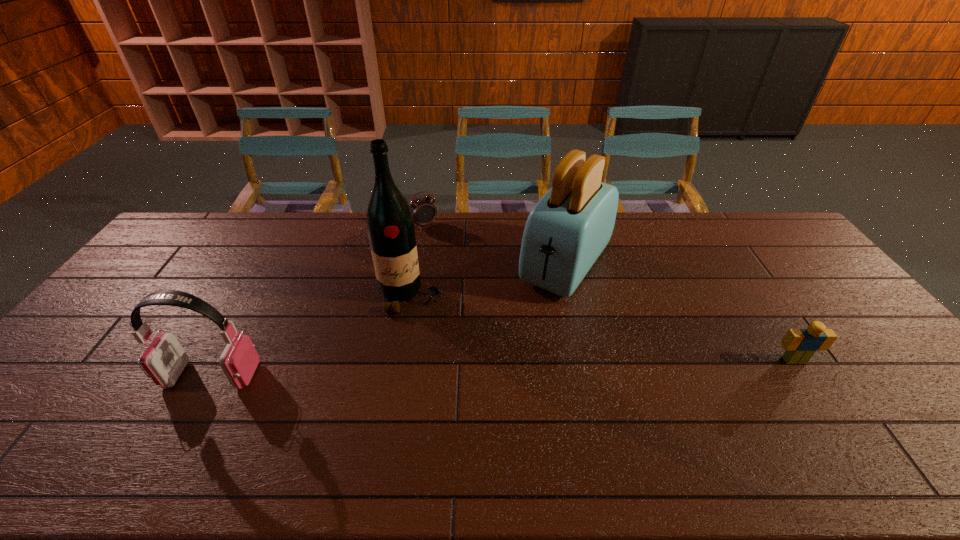
The height and width of the screenshot is (540, 960). I want to click on free space on the desktop that is between the leftmost object and the rightmost object and is positioned on the side of the fourth object from left to right with the lever, so click(x=486, y=368).

Find the location of a particular element. The width and height of the screenshot is (960, 540). free spot on the desktop that is between the leftmost object and the Lego and is positioned on the face of the farthest object is located at coordinates (525, 367).

Image resolution: width=960 pixels, height=540 pixels. What are the coordinates of `vacant space on the desktop that is between the third tallest object and the rightmost object and is positioned on the surface of the wine bottle` in the screenshot? It's located at (453, 369).